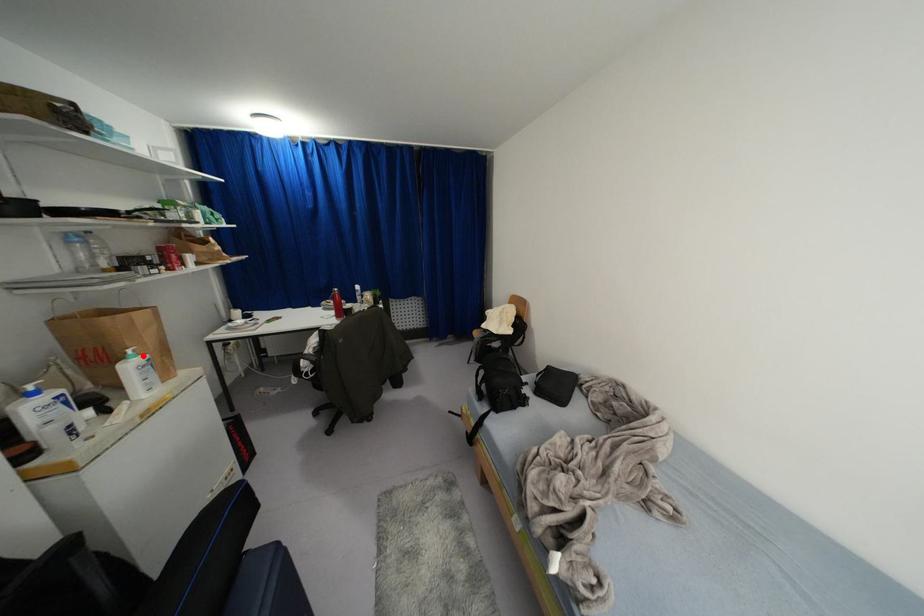
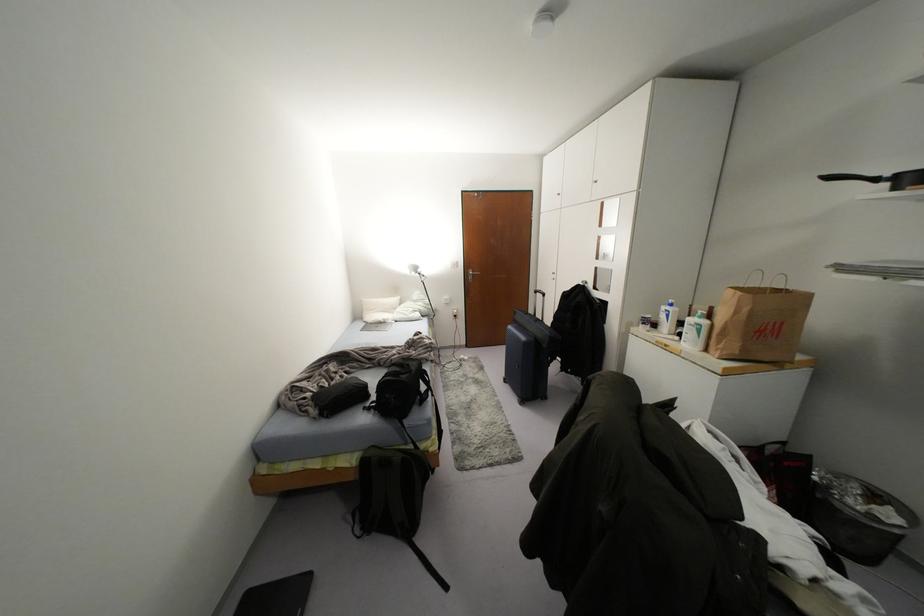
Where in the second image is the point corresponding to the highlighted location from the first image?

(703, 322)